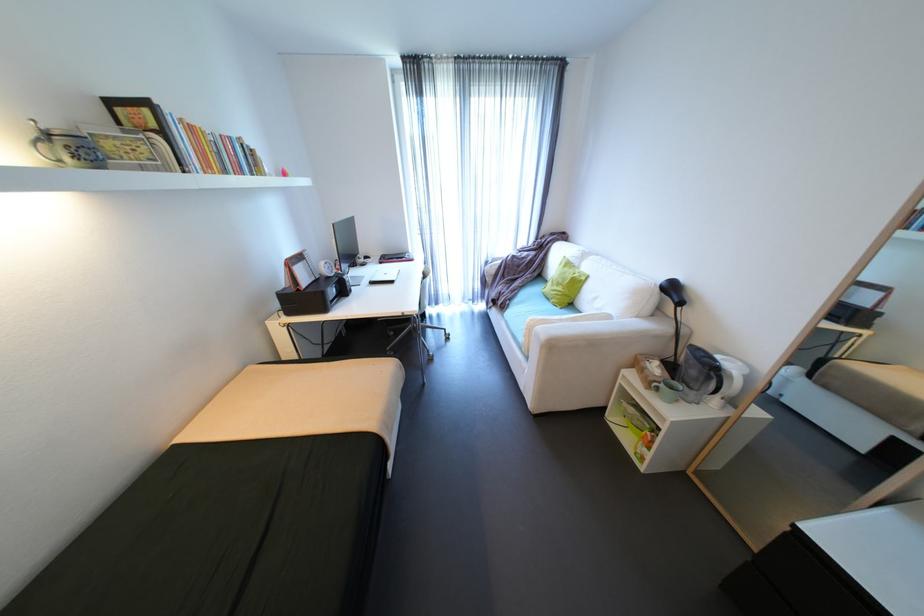
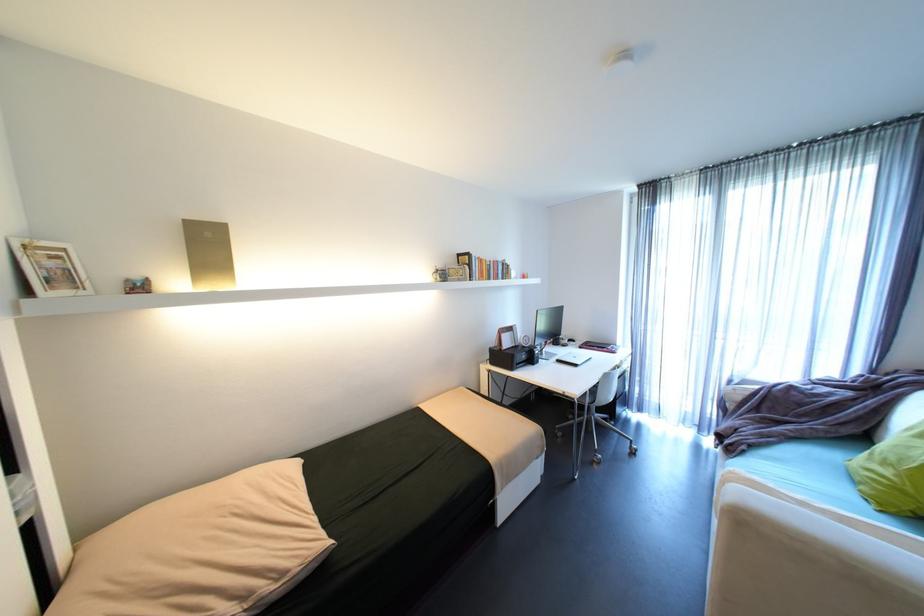
Find the pixel in the second image that matches the point at 42,122 in the first image.

(444, 267)